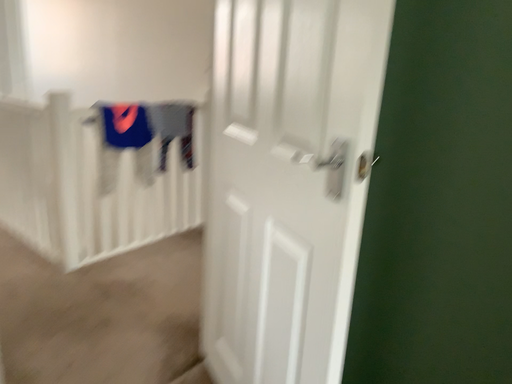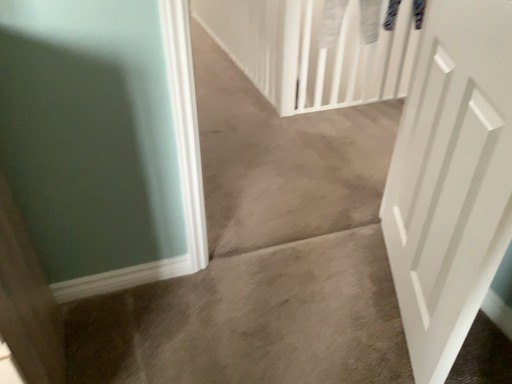
Question: How did the camera likely rotate when shooting the video?

Choices:
 (A) rotated left
 (B) rotated right

Answer: (A)